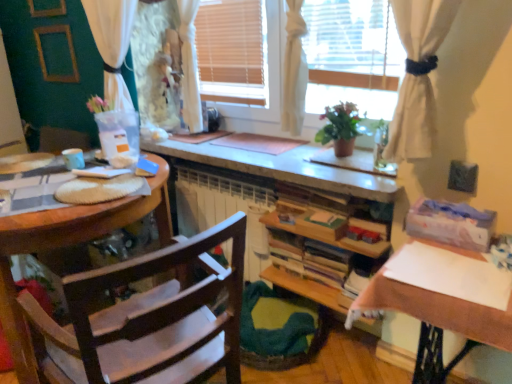
Question: Does white fabric window at center have a smaller size compared to wooden bookshelf at center?

Choices:
 (A) yes
 (B) no

Answer: (B)

Question: Is the position of white fabric window at center less distant than that of wooden bookshelf at center?

Choices:
 (A) yes
 (B) no

Answer: (A)

Question: Does white fabric window at center have a greater height compared to wooden bookshelf at center?

Choices:
 (A) yes
 (B) no

Answer: (A)

Question: Is white fabric window at center completely or partially outside of wooden bookshelf at center?

Choices:
 (A) no
 (B) yes

Answer: (B)

Question: From the image's perspective, does white fabric window at center appear lower than wooden bookshelf at center?

Choices:
 (A) yes
 (B) no

Answer: (B)

Question: In terms of width, does white fabric window at center look wider or thinner when compared to wooden chair at left?

Choices:
 (A) wide
 (B) thin

Answer: (B)

Question: Is white fabric window at center spatially inside wooden chair at left, or outside of it?

Choices:
 (A) outside
 (B) inside

Answer: (A)

Question: In the image, is white fabric window at center on the left side or the right side of wooden chair at left?

Choices:
 (A) right
 (B) left

Answer: (A)

Question: From the image's perspective, is white fabric window at center above or below wooden chair at left?

Choices:
 (A) below
 (B) above

Answer: (B)

Question: From a real-world perspective, is wooden chair at left above or below white sheer curtain at upper left?

Choices:
 (A) below
 (B) above

Answer: (A)

Question: In the image, is wooden chair at left positioned in front of or behind white sheer curtain at upper left?

Choices:
 (A) behind
 (B) front

Answer: (B)

Question: Is wooden chair at left taller or shorter than white sheer curtain at upper left?

Choices:
 (A) tall
 (B) short

Answer: (A)

Question: In terms of size, does wooden chair at left appear bigger or smaller than white sheer curtain at upper left?

Choices:
 (A) big
 (B) small

Answer: (A)

Question: Looking at their shapes, would you say white paper at right is wider or thinner than white sheer curtain at upper left?

Choices:
 (A) thin
 (B) wide

Answer: (B)

Question: From a real-world perspective, is white paper at right physically located above or below white sheer curtain at upper left?

Choices:
 (A) below
 (B) above

Answer: (A)